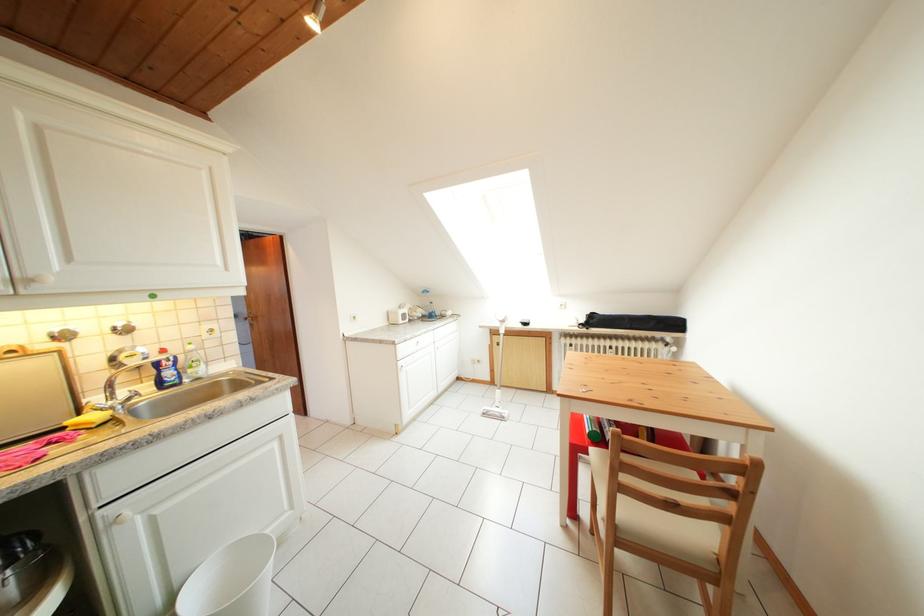
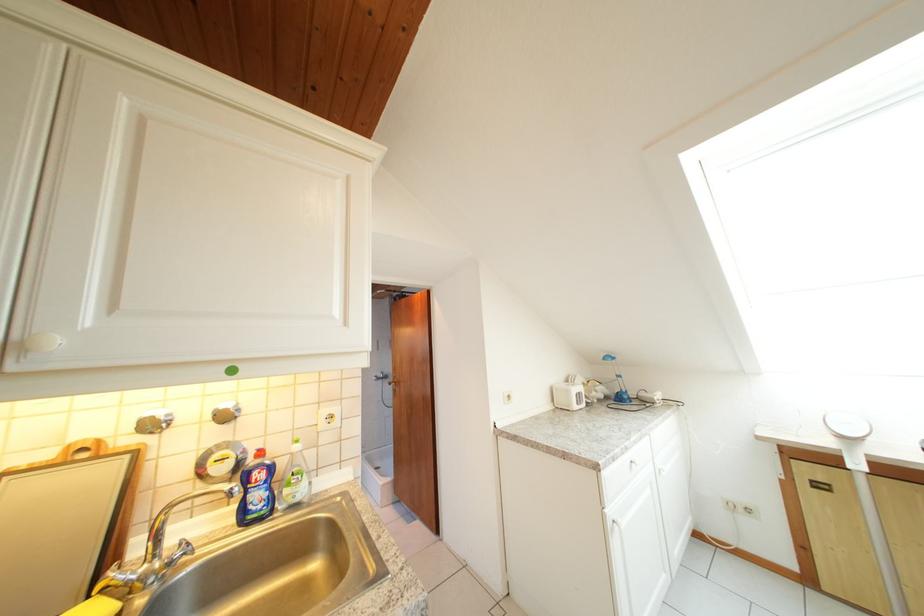
Where in the second image is the point corresponding to the point at 199,376 from the first image?

(295, 496)